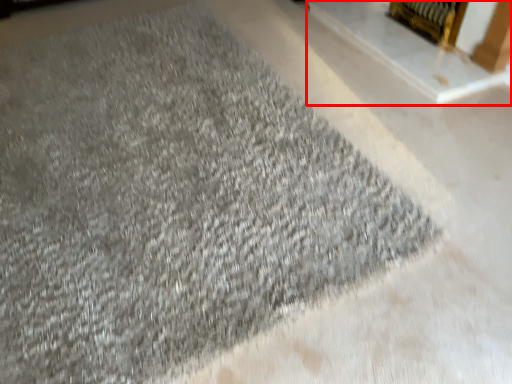
Question: From the image's perspective, where is fireplace (annotated by the red box) located relative to fireplace?

Choices:
 (A) above
 (B) below

Answer: (B)